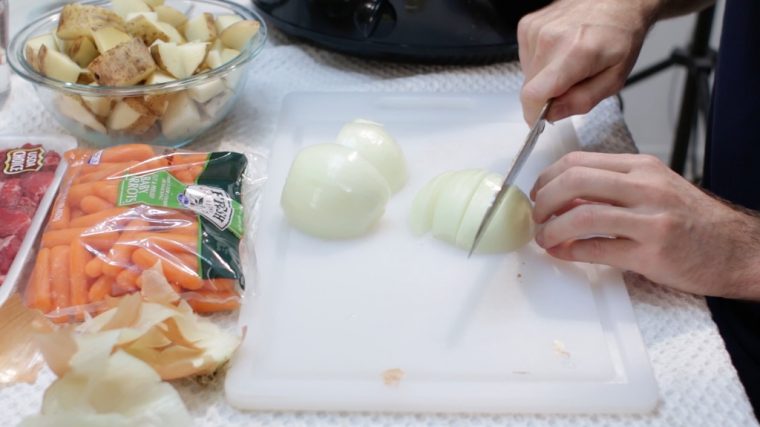
Locate an element on the screen. bowl is located at coordinates (195, 91).